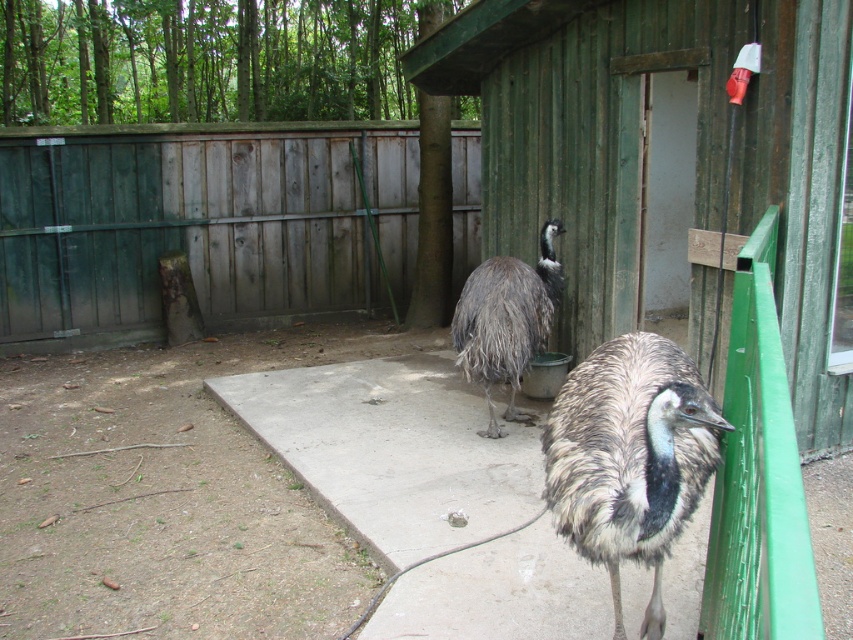
Is brown speckled feathers at center taller than gray feathered ostrich at center?

Incorrect, brown speckled feathers at center's height is not larger of gray feathered ostrich at center's.

Is brown speckled feathers at center smaller than gray feathered ostrich at center?

Correct, brown speckled feathers at center occupies less space than gray feathered ostrich at center.

Is point (607, 349) positioned before point (476, 380)?

Yes, point (607, 349) is in front of point (476, 380).

The image size is (853, 640). I want to click on brown speckled feathers at center, so click(630, 458).

Based on the photo, does weathered wood fence at left have a lesser width compared to brown speckled feathers at center?

No.

Consider the image. Is weathered wood fence at left closer to the viewer compared to brown speckled feathers at center?

No, weathered wood fence at left is further to the viewer.

The height and width of the screenshot is (640, 853). In order to click on weathered wood fence at left in this screenshot , I will do `click(199, 224)`.

Can you confirm if wooden hut at center is shorter than gray feathered ostrich at center?

No, wooden hut at center is not shorter than gray feathered ostrich at center.

Which of these two, wooden hut at center or gray feathered ostrich at center, stands shorter?

Standing shorter between the two is gray feathered ostrich at center.

Between point (598, 90) and point (515, 417), which one is positioned in front?

Point (515, 417) is in front.

Find the location of a particular element. The height and width of the screenshot is (640, 853). wooden hut at center is located at coordinates (670, 168).